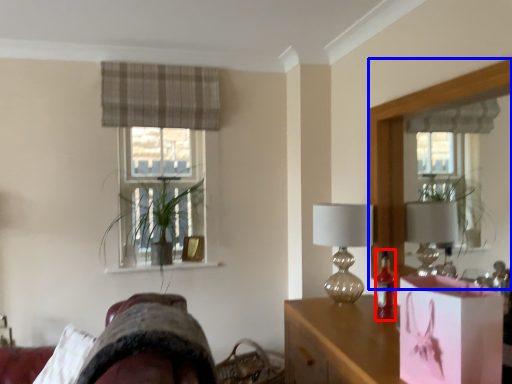
Question: Which of the following is the farthest to the observer, bottle (highlighted by a red box) or mirror (highlighted by a blue box)?

Choices:
 (A) bottle
 (B) mirror

Answer: (A)